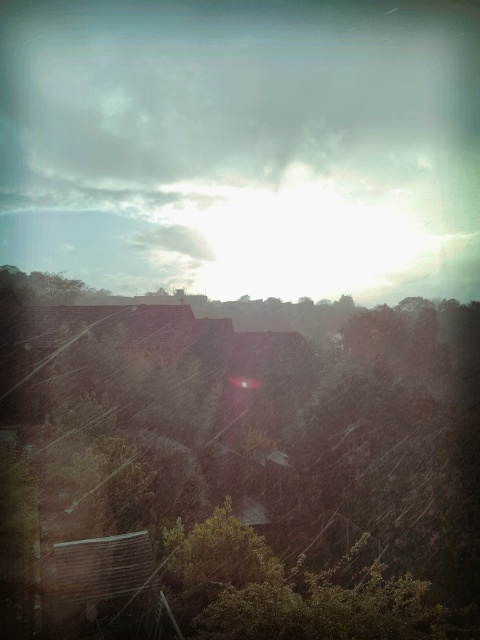
You are an architect designing a new house in this area. You want to ensure that the house has a large window facing the cloudy sky at upper center and a smaller window facing the green leafy tree at center. Based on the scene description, which window should be placed higher on the house?

The cloudy sky at upper center is wider than the green leafy tree at center, so the large window facing the cloudy sky at upper center should be placed higher on the house to accommodate its greater width.

In the scene shown: You are an artist trying to paint the scene. You need to decide which area to focus on first based on their sizes. Which object should you paint first, the cloudy sky at upper center or the green leafy tree at center?

The cloudy sky at upper center is bigger than the green leafy tree at center, so you should paint the cloudy sky at upper center first to ensure it has enough space and detail.